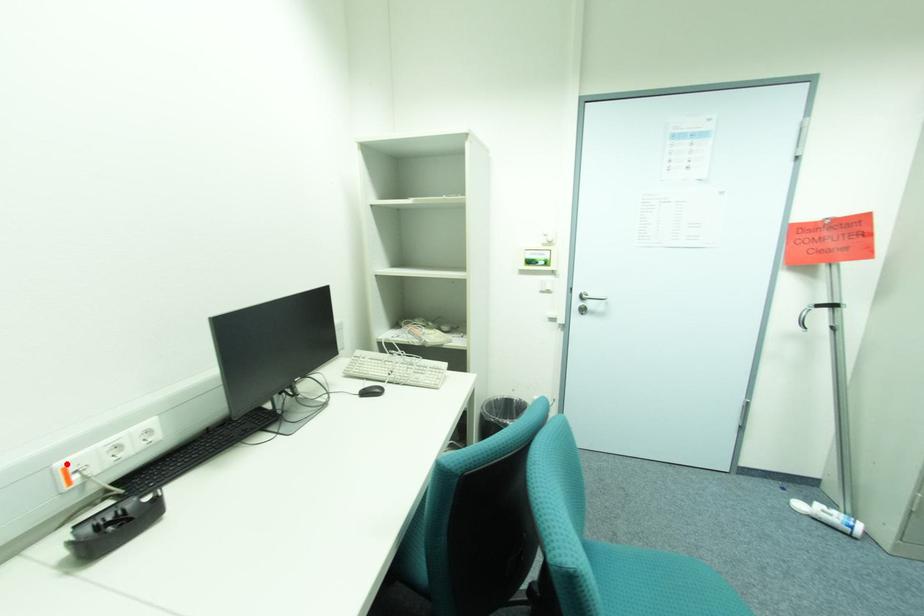
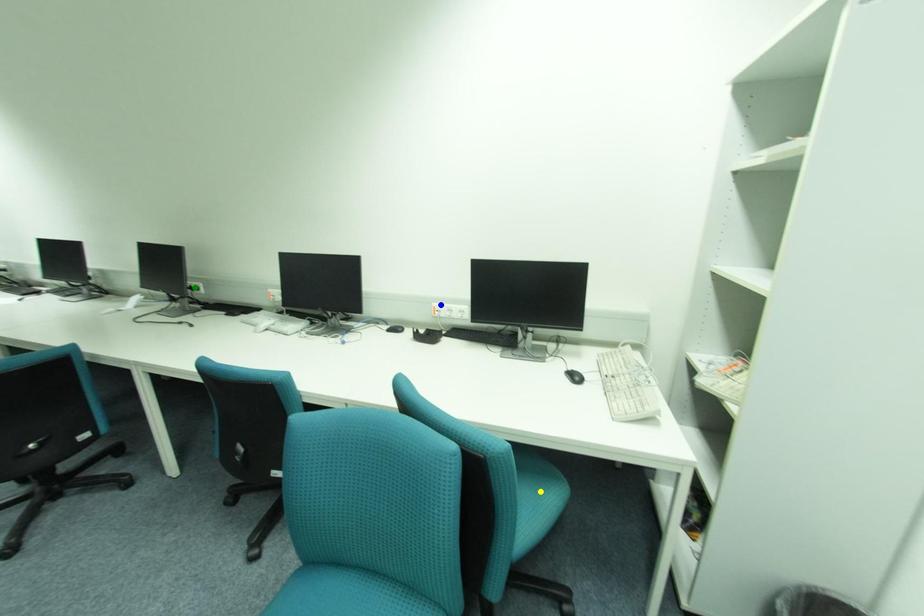
Question: I am providing you with two images of the same scene from different viewpoints. A red point is marked on the first image. You are given multiple points on the second image. Which point in image 2 represents the same 3d spot as the red point in image 1?

Choices:
 (A) yellow point
 (B) blue point
 (C) green point

Answer: (B)